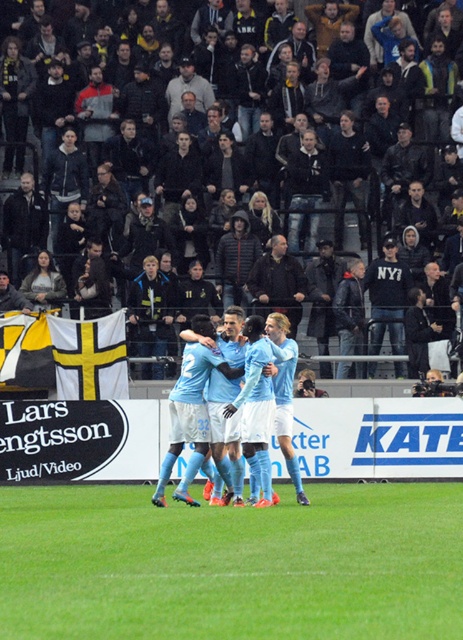
Can you confirm if green grass at center is taller than light blue jersey at center?

In fact, green grass at center may be shorter than light blue jersey at center.

Image resolution: width=463 pixels, height=640 pixels. What do you see at coordinates (231, 564) in the screenshot? I see `green grass at center` at bounding box center [231, 564].

The height and width of the screenshot is (640, 463). I want to click on green grass at center, so click(x=231, y=564).

Can you confirm if dark gray hoodies at center is positioned to the right of light blue jersey at center?

No, dark gray hoodies at center is not to the right of light blue jersey at center.

Locate an element on the screen. This screenshot has height=640, width=463. dark gray hoodies at center is located at coordinates (126, 22).

Find the location of a particular element. dark gray hoodies at center is located at coordinates (126, 22).

Who is positioned more to the right, green grass at center or dark gray hoodies at center?

green grass at center is more to the right.

Measure the distance between green grass at center and dark gray hoodies at center.

15.82 meters

This screenshot has height=640, width=463. I want to click on green grass at center, so click(x=231, y=564).